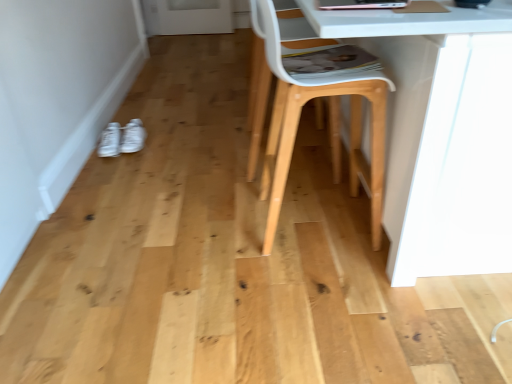
Question: In terms of size, does white fabric sneakers at lower left, which appears as the second footwear when viewed from the right, appear bigger or smaller than white matte sneakers at lower left, the 1th footwear from the right?

Choices:
 (A) big
 (B) small

Answer: (A)

Question: In the image, is white fabric sneakers at lower left, arranged as the 1th footwear when viewed from the left, on the left side or the right side of white matte sneakers at lower left, positioned as the second footwear in left-to-right order?

Choices:
 (A) left
 (B) right

Answer: (A)

Question: Considering the real-world distances, which object is farthest from the white fabric sneakers at lower left, arranged as the 1th footwear when viewed from the left?

Choices:
 (A) white plastic swivel chair at center
 (B) natural wood chair at center
 (C) white matte sneakers at lower left, the 1th footwear from the right

Answer: (B)

Question: Estimate the real-world distances between objects in this image. Which object is closer to the white fabric sneakers at lower left, arranged as the 1th footwear when viewed from the left?

Choices:
 (A) natural wood chair at center
 (B) white matte sneakers at lower left, the 1th footwear from the right
 (C) white plastic swivel chair at center

Answer: (B)